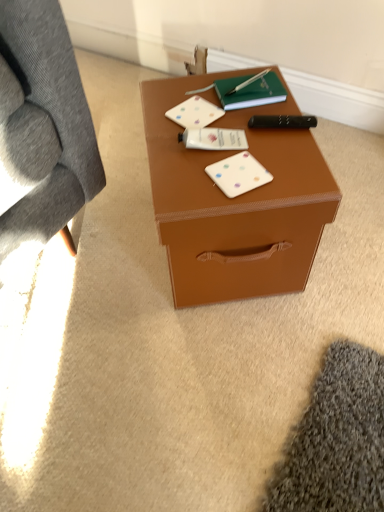
Question: Can you confirm if white matte card game at center, which is counted as the 1th card game, starting from the top, is thinner than black plastic remote control at right?

Choices:
 (A) no
 (B) yes

Answer: (A)

Question: Does white matte card game at center, acting as the second card game starting from the front, come behind black plastic remote control at right?

Choices:
 (A) no
 (B) yes

Answer: (B)

Question: Considering the relative sizes of white matte card game at center, placed as the second card game when sorted from bottom to top, and black plastic remote control at right in the image provided, is white matte card game at center, placed as the second card game when sorted from bottom to top, taller than black plastic remote control at right?

Choices:
 (A) no
 (B) yes

Answer: (A)

Question: From a real-world perspective, is white matte card game at center, which is counted as the 1th card game, starting from the top, located beneath black plastic remote control at right?

Choices:
 (A) yes
 (B) no

Answer: (A)

Question: From a real-world perspective, is white matte card game at center, the first card game in the back-to-front sequence, located higher than black plastic remote control at right?

Choices:
 (A) yes
 (B) no

Answer: (B)

Question: Is point (188, 120) closer or farther from the camera than point (150, 124)?

Choices:
 (A) closer
 (B) farther

Answer: (A)

Question: Do you think white matte card game at center, placed as the second card game when sorted from bottom to top, is within brown matte box at center, or outside of it?

Choices:
 (A) outside
 (B) inside

Answer: (B)

Question: From a real-world perspective, is white matte card game at center, acting as the second card game starting from the front, above or below brown matte box at center?

Choices:
 (A) below
 (B) above

Answer: (B)

Question: In terms of width, does white matte card game at center, acting as the second card game starting from the front, look wider or thinner when compared to brown matte box at center?

Choices:
 (A) wide
 (B) thin

Answer: (B)

Question: From the image's perspective, is green matte notebook at upper center positioned above or below white matte card game at center, which ranks as the 2th card game in back-to-front order?

Choices:
 (A) above
 (B) below

Answer: (A)

Question: Would you say green matte notebook at upper center is inside or outside white matte card game at center, which ranks as the 2th card game in back-to-front order?

Choices:
 (A) inside
 (B) outside

Answer: (B)

Question: Is green matte notebook at upper center in front of or behind white matte card game at center, placed as the 2th card game when sorted from top to bottom, in the image?

Choices:
 (A) behind
 (B) front

Answer: (A)

Question: Is point (238, 86) closer or farther from the camera than point (238, 179)?

Choices:
 (A) farther
 (B) closer

Answer: (A)

Question: From the image's perspective, relative to black plastic remote control at right, is white matte card game at center, placed as the second card game when sorted from bottom to top, above or below?

Choices:
 (A) above
 (B) below

Answer: (A)

Question: Looking at their shapes, would you say white matte card game at center, placed as the second card game when sorted from bottom to top, is wider or thinner than black plastic remote control at right?

Choices:
 (A) thin
 (B) wide

Answer: (B)